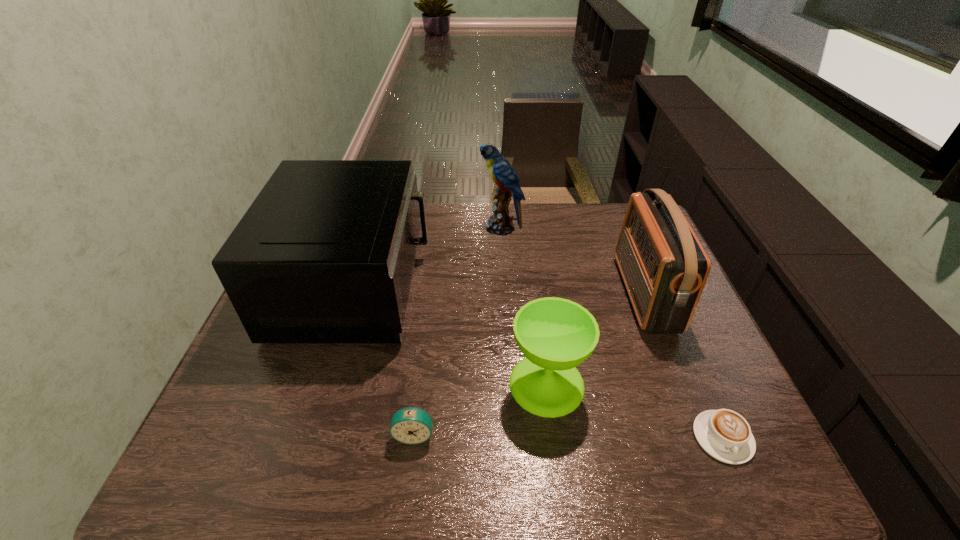
This screenshot has height=540, width=960. Find the location of `free spot between the cappuccino and the fifth tallest object`. free spot between the cappuccino and the fifth tallest object is located at coordinates (568, 436).

Where is `free space between the wineglass and the microwave_oven`? The image size is (960, 540). free space between the wineglass and the microwave_oven is located at coordinates (451, 335).

Locate an element on the screen. free space between the cappuccino and the farthest object is located at coordinates (612, 333).

The height and width of the screenshot is (540, 960). I want to click on free space between the alarm clock and the shortest object, so click(x=568, y=436).

Select which object is the fourth closest to the microwave_oven. Please provide its 2D coordinates. Your answer should be formatted as a tuple, i.e. [(x, y)], where the tuple contains the x and y coordinates of a point satisfying the conditions above.

[(664, 267)]

Select which object is the fourth closest to the radio receiver. Please provide its 2D coordinates. Your answer should be formatted as a tuple, i.e. [(x, y)], where the tuple contains the x and y coordinates of a point satisfying the conditions above.

[(410, 425)]

This screenshot has height=540, width=960. In order to click on free space that satisfies the following two spatial constraints: 1. on the face of the parrot; 2. on the front-facing side of the alarm clock in this screenshot , I will do `click(513, 434)`.

The height and width of the screenshot is (540, 960). Find the location of `free space in the image that satisfies the following two spatial constraints: 1. on the face of the farthest object; 2. on the back side of the wineglass`. free space in the image that satisfies the following two spatial constraints: 1. on the face of the farthest object; 2. on the back side of the wineglass is located at coordinates (510, 384).

Where is `blank area in the image that satisfies the following two spatial constraints: 1. on the front-facing side of the radio receiver; 2. on the front-facing side of the alarm clock`? The image size is (960, 540). blank area in the image that satisfies the following two spatial constraints: 1. on the front-facing side of the radio receiver; 2. on the front-facing side of the alarm clock is located at coordinates (700, 434).